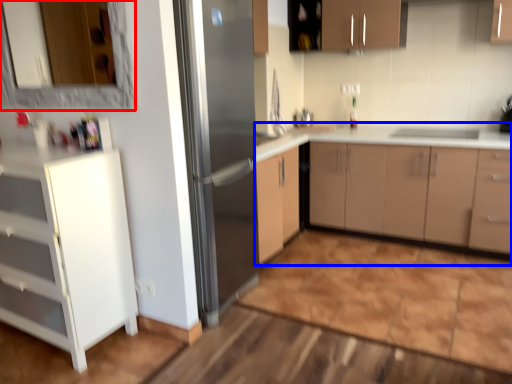
Question: Which object appears closest to the camera in this image, mirror (highlighted by a red box) or cabinetry (highlighted by a blue box)?

Choices:
 (A) mirror
 (B) cabinetry

Answer: (A)